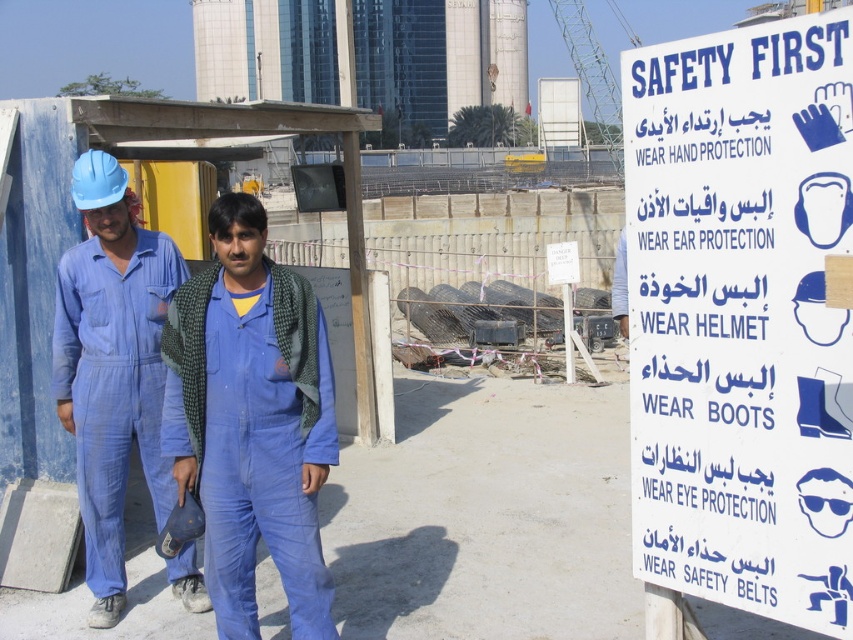
You are a safety inspector at the construction site. You need to check if the white paper sign at upper right is properly positioned relative to the blue fabric jumpsuit at center according to safety regulations. According to the scene, is the sign visible to workers wearing the jumpsuit?

The white paper sign at upper right is in front of the blue fabric jumpsuit at center, so it is visible to workers wearing the jumpsuit.

You are a safety inspector at a construction site. You need to ensure that the distance between the blue matte jumpsuit at center and the blue fabric jumpsuit at center meets the minimum 30 inches social distancing guideline. Is the current distance compliant?

The blue matte jumpsuit at center is 32.65 inches away from the blue fabric jumpsuit at center, which exceeds the minimum 30 inches requirement. Therefore, the current distance is compliant with the social distancing guideline.

You are a new worker at the construction site and need to locate the safety instructions. Where exactly is the white paper sign at upper right positioned in the image?

The white paper sign at upper right is positioned at the 2D coordinates point (741, 316) in the image.